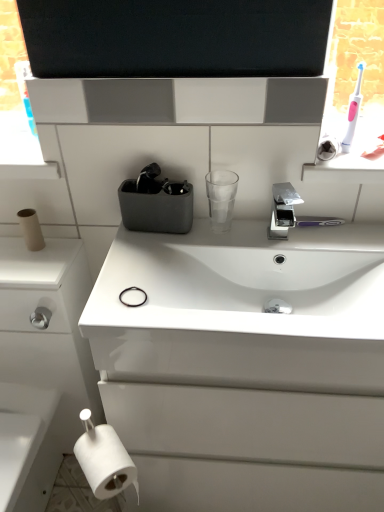
Locate an element on the screen. vacant area that is in front of white cardboard toilet paper at left, marked as the first toilet paper in a top-to-bottom arrangement is located at coordinates (28, 267).